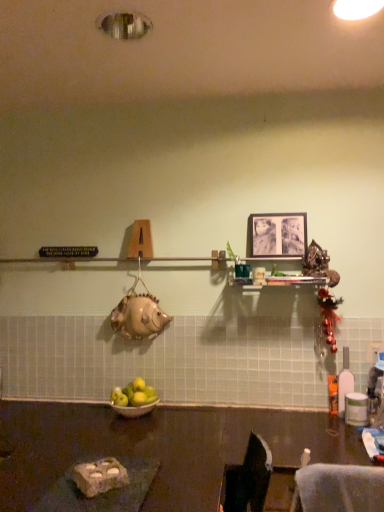
Question: Is green matte apples at center to the right of dark brown polished table at lower center from the viewer's perspective?

Choices:
 (A) yes
 (B) no

Answer: (B)

Question: Is green matte apples at center positioned in front of dark brown polished table at lower center?

Choices:
 (A) yes
 (B) no

Answer: (B)

Question: From a real-world perspective, is green matte apples at center physically below dark brown polished table at lower center?

Choices:
 (A) yes
 (B) no

Answer: (B)

Question: Does green matte apples at center come behind dark brown polished table at lower center?

Choices:
 (A) yes
 (B) no

Answer: (A)

Question: Does green matte apples at center have a smaller size compared to dark brown polished table at lower center?

Choices:
 (A) no
 (B) yes

Answer: (B)

Question: Can you confirm if green matte apples at center is wider than dark brown polished table at lower center?

Choices:
 (A) no
 (B) yes

Answer: (A)

Question: Does black matte picture frame at upper center appear on the right side of silver metallic bowl at center?

Choices:
 (A) yes
 (B) no

Answer: (A)

Question: Considering the relative sizes of black matte picture frame at upper center and silver metallic bowl at center in the image provided, is black matte picture frame at upper center wider than silver metallic bowl at center?

Choices:
 (A) no
 (B) yes

Answer: (A)

Question: From the image's perspective, is black matte picture frame at upper center beneath silver metallic bowl at center?

Choices:
 (A) no
 (B) yes

Answer: (A)

Question: Is black matte picture frame at upper center at the left side of silver metallic bowl at center?

Choices:
 (A) no
 (B) yes

Answer: (A)

Question: Is black matte picture frame at upper center placed right next to silver metallic bowl at center?

Choices:
 (A) yes
 (B) no

Answer: (B)

Question: Does black matte picture frame at upper center have a lesser width compared to silver metallic bowl at center?

Choices:
 (A) yes
 (B) no

Answer: (A)

Question: Does black matte picture frame at upper center have a greater width compared to translucent plastic bottle at right?

Choices:
 (A) no
 (B) yes

Answer: (A)